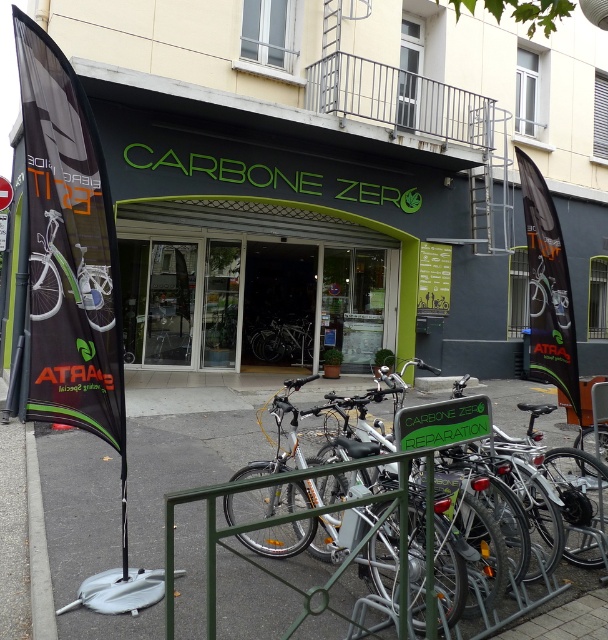
Where is `gray concrete pavement at lower left`? This screenshot has height=640, width=608. gray concrete pavement at lower left is located at coordinates coord(181,465).

Does gray concrete pavement at lower left appear under shiny silver bicycle at center?

Correct, gray concrete pavement at lower left is located below shiny silver bicycle at center.

Is point (88, 531) closer to viewer compared to point (266, 348)?

Yes, it is.

Locate an element on the screen. Image resolution: width=608 pixels, height=640 pixels. gray concrete pavement at lower left is located at coordinates (181, 465).

At what (x,y) coordinates should I click in order to perform the action: click on green matte storefront at center. Please return your answer as a coordinate pair (x, y). This screenshot has width=608, height=640. Looking at the image, I should click on (254, 285).

Is green matte storefront at center closer to camera compared to shiny silver bicycle at center?

Yes, green matte storefront at center is closer to the viewer.

Measure the distance between point (x=198, y=353) and camera.

A distance of 11.34 meters exists between point (x=198, y=353) and camera.

Locate an element on the screen. This screenshot has height=640, width=608. green matte storefront at center is located at coordinates (254, 285).

Which is behind, point (69, 468) or point (213, 364)?

The point (213, 364) is behind.

Which is in front, point (204, 572) or point (257, 356)?

Point (204, 572)

Locate an element on the screen. This screenshot has width=608, height=640. gray concrete pavement at lower left is located at coordinates (181, 465).